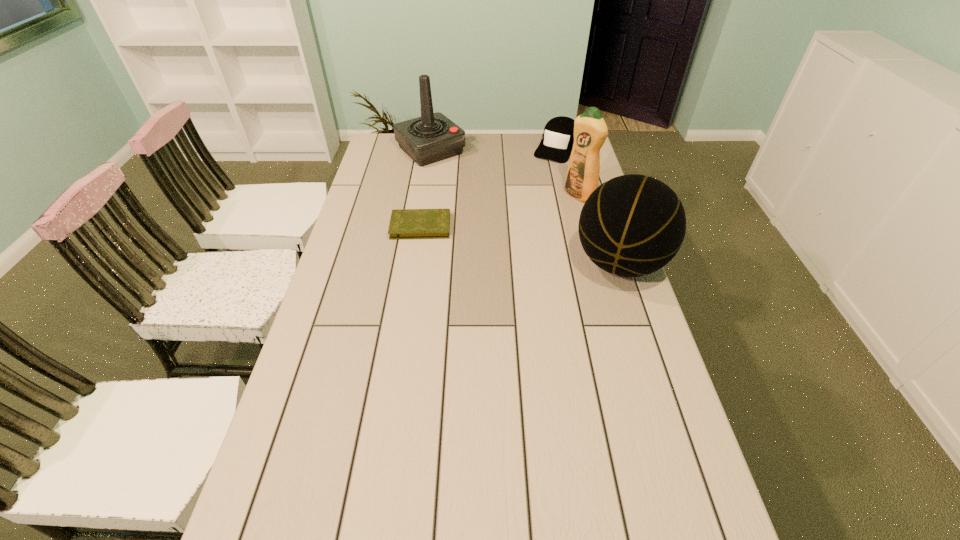
Locate an element on the screen. The height and width of the screenshot is (540, 960). empty space that is in between the joystick and the detergent is located at coordinates (505, 173).

Identify the location of unoccupied position between the joystick and the basketball. This screenshot has width=960, height=540. click(525, 207).

Where is `unoccupied area between the joystick and the cap`? Image resolution: width=960 pixels, height=540 pixels. unoccupied area between the joystick and the cap is located at coordinates (493, 148).

Locate an element on the screen. free space between the joystick and the third nearest object is located at coordinates (505, 173).

At what (x,y) coordinates should I click in order to perform the action: click on vacant area that lies between the joystick and the shortest object. Please return your answer as a coordinate pair (x, y). This screenshot has height=540, width=960. Looking at the image, I should click on (425, 188).

Locate an element on the screen. This screenshot has height=540, width=960. free spot between the shortest object and the basketball is located at coordinates (520, 245).

At what (x,y) coordinates should I click in order to perform the action: click on empty location between the shortest object and the third nearest object. Please return your answer as a coordinate pair (x, y). This screenshot has width=960, height=540. Looking at the image, I should click on (500, 211).

Identify which object is the second nearest to the joystick. Please provide its 2D coordinates. Your answer should be formatted as a tuple, i.e. [(x, y)], where the tuple contains the x and y coordinates of a point satisfying the conditions above.

[(405, 223)]

Locate an element on the screen. The width and height of the screenshot is (960, 540). object that is the fourth closest to the fourth tallest object is located at coordinates (405, 223).

In order to click on vacant space that satisfies the following two spatial constraints: 1. on the front side of the joystick; 2. on the left side of the shortest object in this screenshot , I will do `click(419, 226)`.